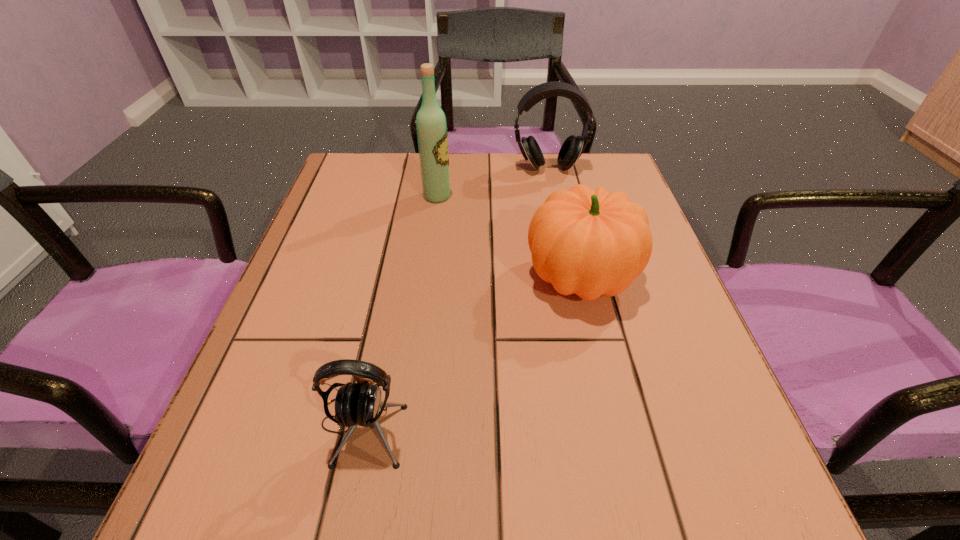
This screenshot has width=960, height=540. I want to click on vacant region at the near edge, so click(447, 480).

Identify the location of vacant position at the left edge of the desktop. Image resolution: width=960 pixels, height=540 pixels. (316, 255).

In the image, there is a desktop. What are the coordinates of `free region at the far left corner` in the screenshot? It's located at (368, 181).

Locate an element on the screen. free space at the far right corner of the desktop is located at coordinates (627, 183).

I want to click on empty space between the shorter earphone and the third farthest object, so click(471, 352).

You are a GUI agent. You are given a task and a screenshot of the screen. Output one action in this format:
    pyautogui.click(x=<x>, y=<y>)
    Task: Click on the blank region between the wine bottle and the right earphone
    This screenshot has height=540, width=960.
    Given the screenshot: What is the action you would take?
    pyautogui.click(x=492, y=183)

Locate an element on the screen. free point between the nearer earphone and the third farthest object is located at coordinates (471, 352).

Locate an element on the screen. The image size is (960, 540). vacant space in between the wine bottle and the taller earphone is located at coordinates (492, 183).

Identify the location of vacant point located between the wine bottle and the pumpkin. The width and height of the screenshot is (960, 540). (509, 237).

Where is `unoccupied area between the nearest object and the pumpkin`? unoccupied area between the nearest object and the pumpkin is located at coordinates (471, 352).